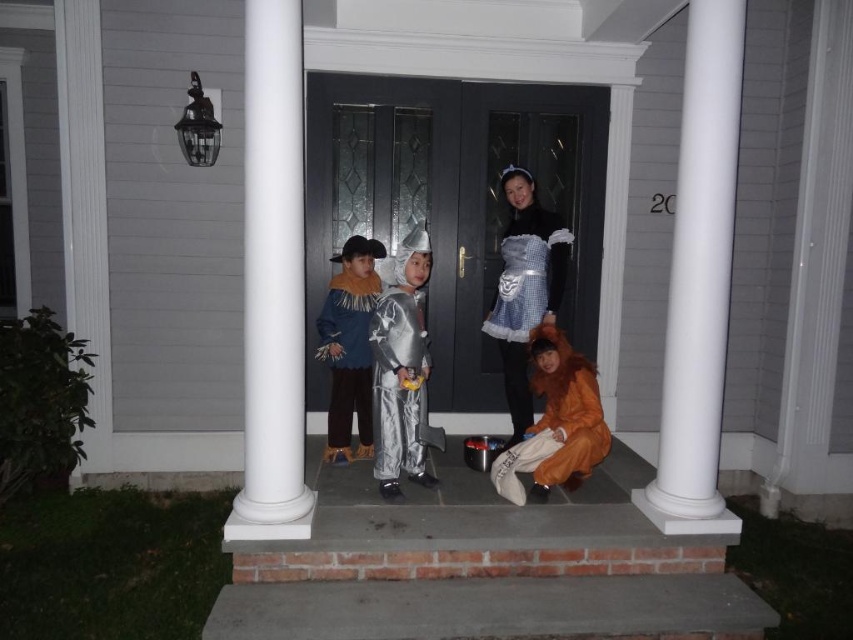
Does white smooth column at right appear on the right side of orange plush costume at lower right?

Indeed, white smooth column at right is positioned on the right side of orange plush costume at lower right.

Between white smooth column at right and orange plush costume at lower right, which one has more height?

With more height is white smooth column at right.

You are a GUI agent. You are given a task and a screenshot of the screen. Output one action in this format:
    pyautogui.click(x=<x>, y=<y>)
    Task: Click on the white smooth column at right
    
    Given the screenshot: What is the action you would take?
    pyautogui.click(x=699, y=278)

Is white smooth column at center below white smooth column at right?

Yes.

Does white smooth column at center have a lesser width compared to white smooth column at right?

Correct, white smooth column at center's width is less than white smooth column at right's.

The width and height of the screenshot is (853, 640). What do you see at coordinates (271, 280) in the screenshot?
I see `white smooth column at center` at bounding box center [271, 280].

In order to click on white smooth column at center in this screenshot , I will do `click(271, 280)`.

Is point (556, 275) positioned before point (332, 348)?

No, (556, 275) is further to viewer.

From the picture: Does white gingham dress at center come behind blue felt coat at center?

No, white gingham dress at center is in front of blue felt coat at center.

Who is more forward, (525, 365) or (352, 333)?

Positioned in front is point (352, 333).

Find the location of a particular element. white gingham dress at center is located at coordinates (525, 288).